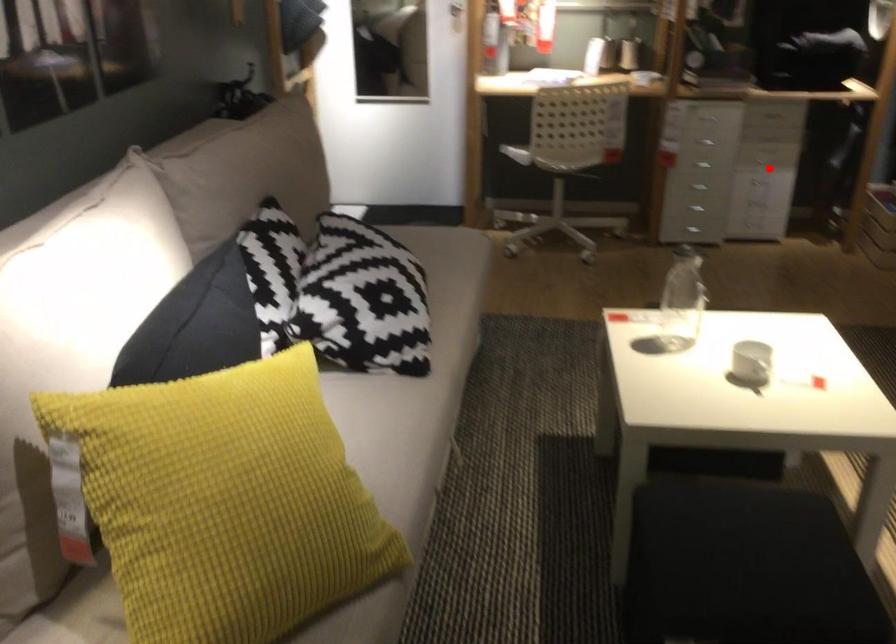
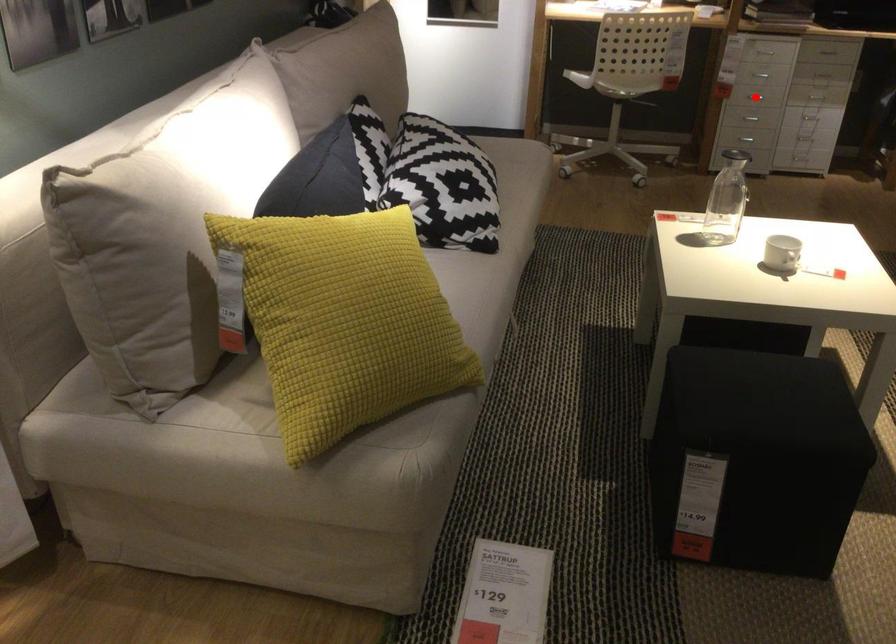
In the scene shown: I am providing you with two images of the same scene from different viewpoints. A red point is marked on the first image and another point is marked on the second image. Are the points marked in image1 and image2 representing the same 3D position?

No